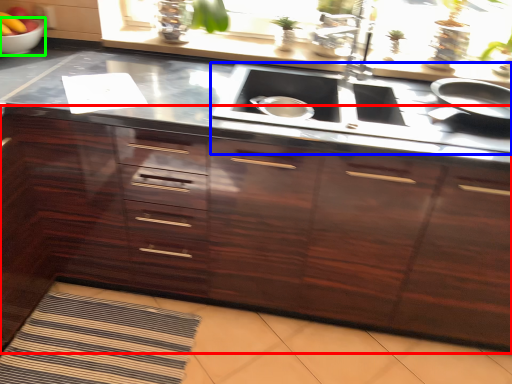
Question: Estimate the real-world distances between objects in this image. Which object is closer to cabinetry (highlighted by a red box), stove (highlighted by a blue box) or mixing bowl (highlighted by a green box)?

Choices:
 (A) stove
 (B) mixing bowl

Answer: (A)